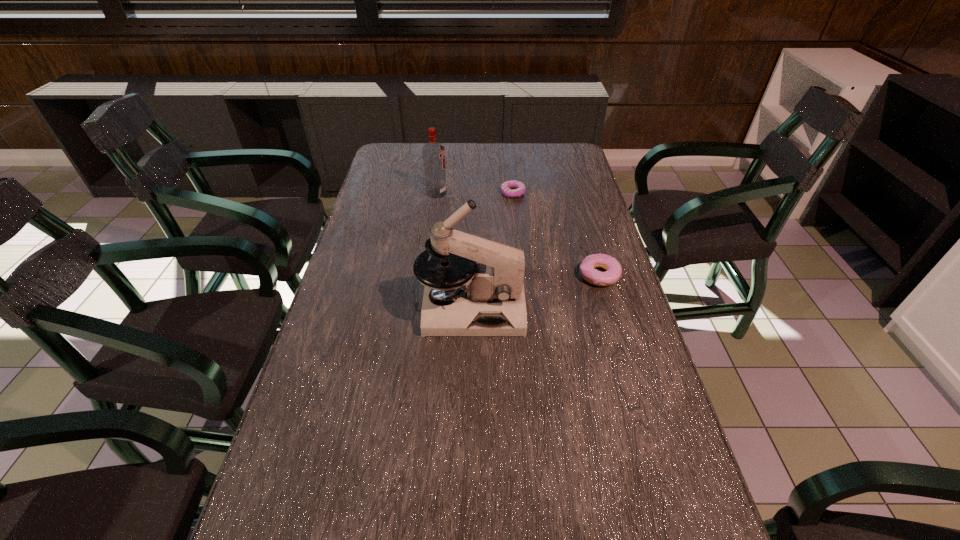
You are a GUI agent. You are given a task and a screenshot of the screen. Output one action in this format:
    pyautogui.click(x=<x>, y=<y>)
    Task: Click on the microscope
    This screenshot has width=960, height=540.
    Given the screenshot: What is the action you would take?
    coord(489,296)

This screenshot has width=960, height=540. In order to click on vodka in this screenshot , I will do `click(433, 153)`.

This screenshot has width=960, height=540. Identify the location of the second shortest object. (613, 267).

The height and width of the screenshot is (540, 960). I want to click on the rightmost object, so click(613, 267).

Find the location of a particular element. The width and height of the screenshot is (960, 540). the farther doughnut is located at coordinates (506, 187).

The image size is (960, 540). I want to click on the left doughnut, so click(x=506, y=187).

Find the location of `vacant point located at the eyepiece of the tallest object`. vacant point located at the eyepiece of the tallest object is located at coordinates (633, 309).

Where is `free spot located on the front label of the third shortest object`? free spot located on the front label of the third shortest object is located at coordinates (519, 193).

Where is `free location located on the left of the third tallest object`? free location located on the left of the third tallest object is located at coordinates (539, 275).

Find the location of a particular element. Image resolution: width=960 pixels, height=540 pixels. vacant position located on the front of the shortest object is located at coordinates (518, 248).